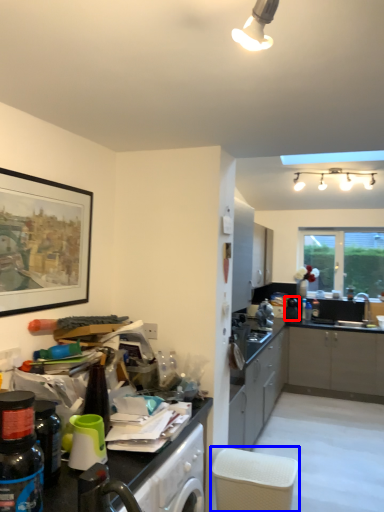
Question: Among these objects, which one is farthest to the camera, appliance (highlighted by a red box) or chair (highlighted by a blue box)?

Choices:
 (A) appliance
 (B) chair

Answer: (A)